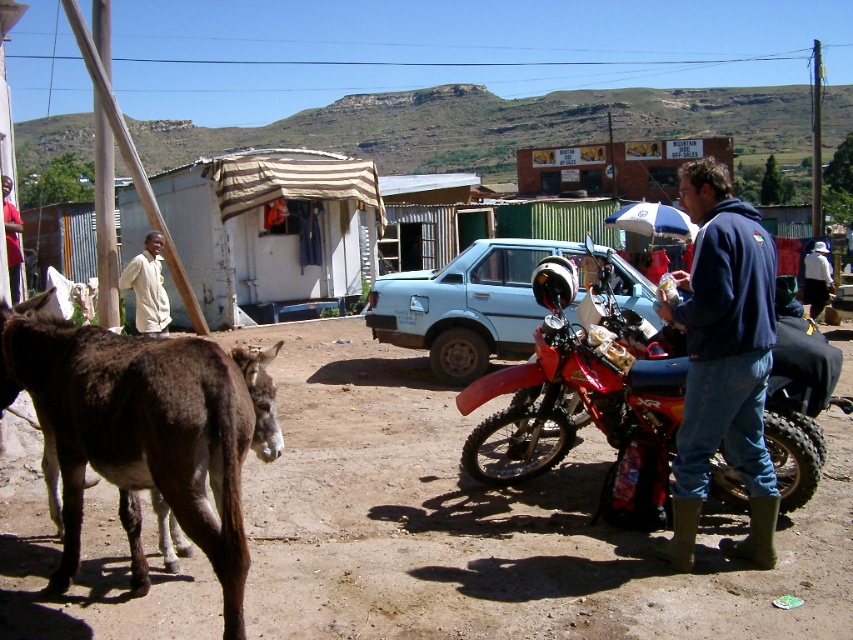
You are a photographer trying to capture the light beige shirt at left and the brushed metal water at bottle left in the same frame. Which object should you focus on first to ensure both are in the frame?

The light beige shirt at left occupies less space than the brushed metal water at bottle left, so you should focus on the larger object first to ensure both fit in the frame.

You are a hiker trying to find shelter from an incoming storm. You see the light blue matte car at center and the light beige shirt at left. Which object is closer to the ground?

The light blue matte car at center is located below the light beige shirt at left, so the car is closer to the ground.

You are a photographer trying to capture the light beige shirt at left and the brushed metal water at bottle left in the same frame. Which object should you focus on first if you want to ensure both are in focus without adjusting your camera settings?

The light beige shirt at left has a lesser width compared to the brushed metal water at bottle left, so you should focus on the wider object first to ensure depth of field covers both.